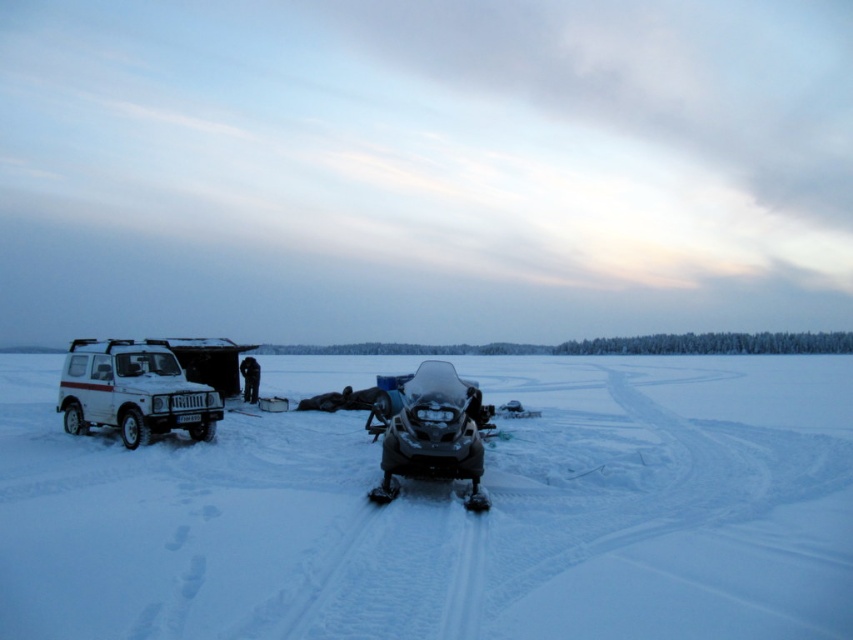
You are standing at the point marked by the coordinates (x=132, y=392) in the winter scene. What object is located exactly at this point?

The point marked by the coordinates (x=132, y=392) corresponds to the white matte jeep at left.

You are a photographer planning to take a photo of the white matte jeep at left and the shiny black snowmobile at center. Since you want both vehicles to be in the frame, which vehicle should you position closer to the camera to ensure the other remains in the background?

You should position the white matte jeep at left closer to the camera because it is already on the left side of the shiny black snowmobile at center, so adjusting its position can help frame both vehicles effectively without overlapping.

You are planning to drive a small toy car from the white matte jeep at left to the white matte snow at center. Which direction should you drive the toy car to reach the snow?

The white matte snow at center is located below the white matte jeep at left, so you should drive the toy car downward to reach the snow.